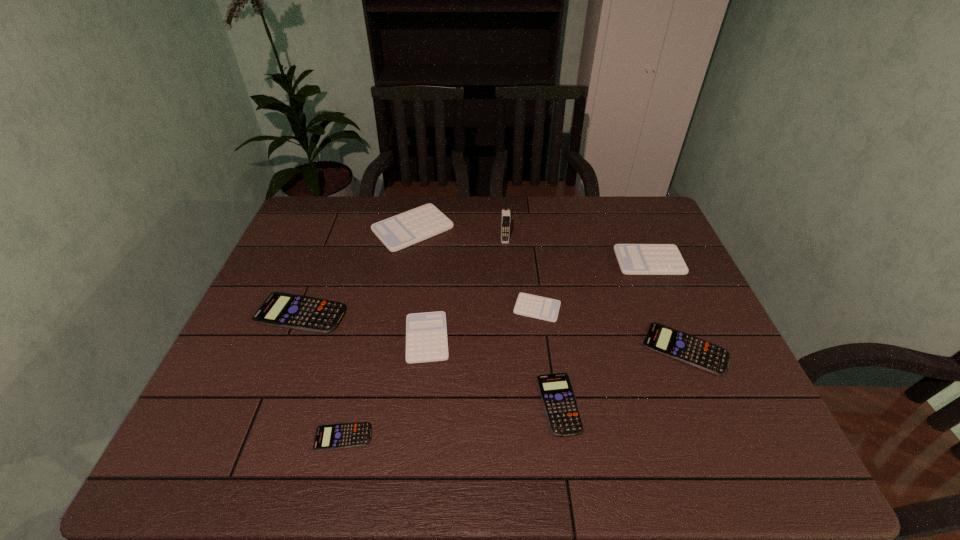
Identify which blue calculator is located as the third nearest to the eighth shortest object. Please provide its 2D coordinates. Your answer should be formatted as a tuple, i.e. [(x, y)], where the tuple contains the x and y coordinates of a point satisfying the conditions above.

[(357, 434)]

Identify the location of blank space that satisfies the following two spatial constraints: 1. on the back side of the biggest blue calculator; 2. on the left side of the rightmost white calculator. (322, 261).

This screenshot has width=960, height=540. In order to click on vacant space that satisfies the following two spatial constraints: 1. on the front side of the third smallest blue calculator; 2. on the left side of the second white calculator from right to left in this screenshot , I will do `click(542, 348)`.